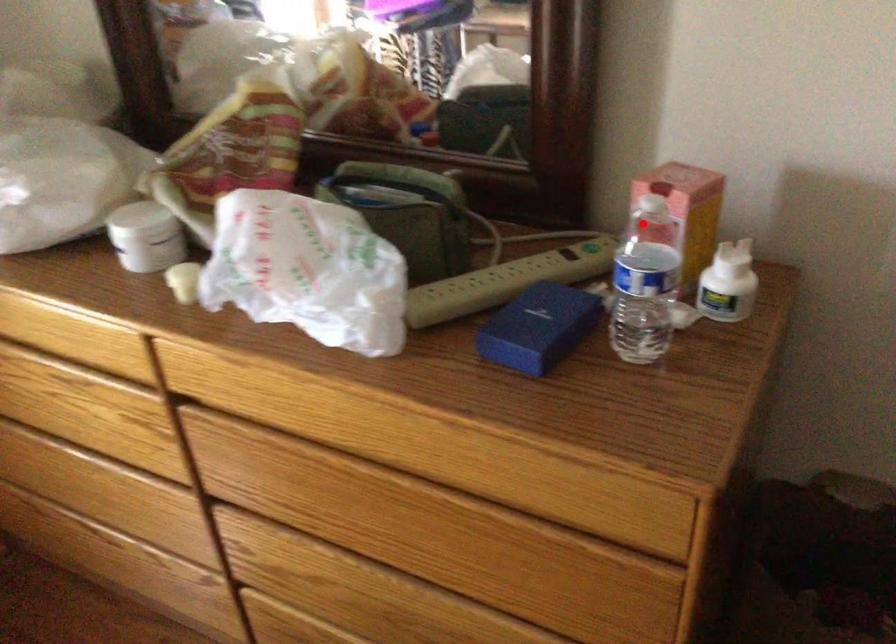
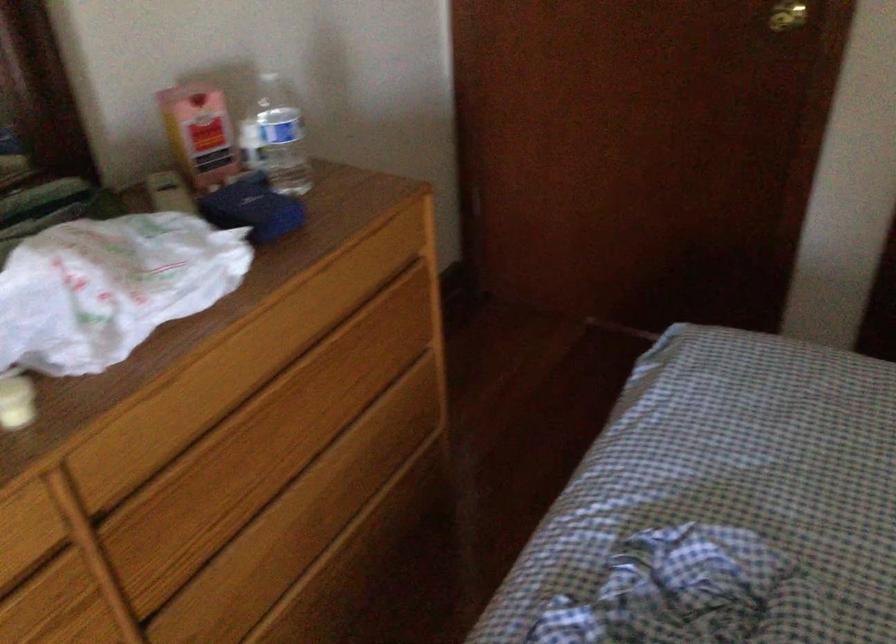
In the second image, find the point that corresponds to the highlighted location in the first image.

(200, 134)